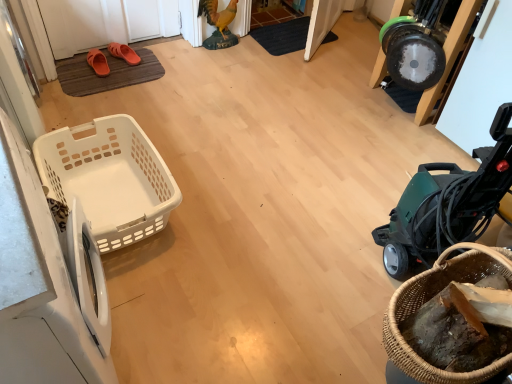
Image resolution: width=512 pixels, height=384 pixels. In order to click on vacant area that is situated to the right of brown rubber doormat at upper left, which is the first doormat from left to right in this screenshot , I will do `click(180, 84)`.